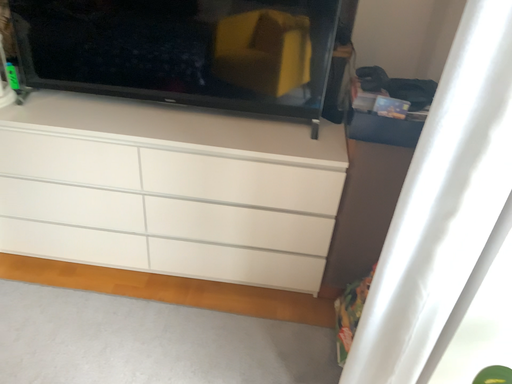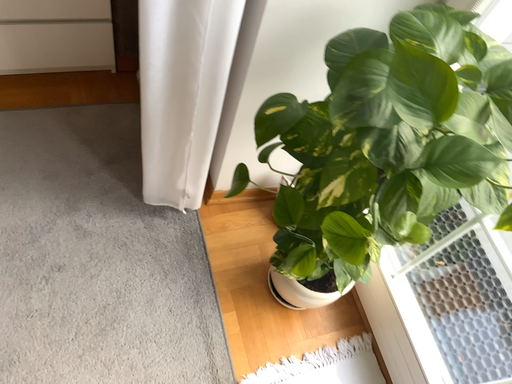
Question: Which way did the camera rotate in the video?

Choices:
 (A) rotated downward
 (B) rotated upward

Answer: (A)